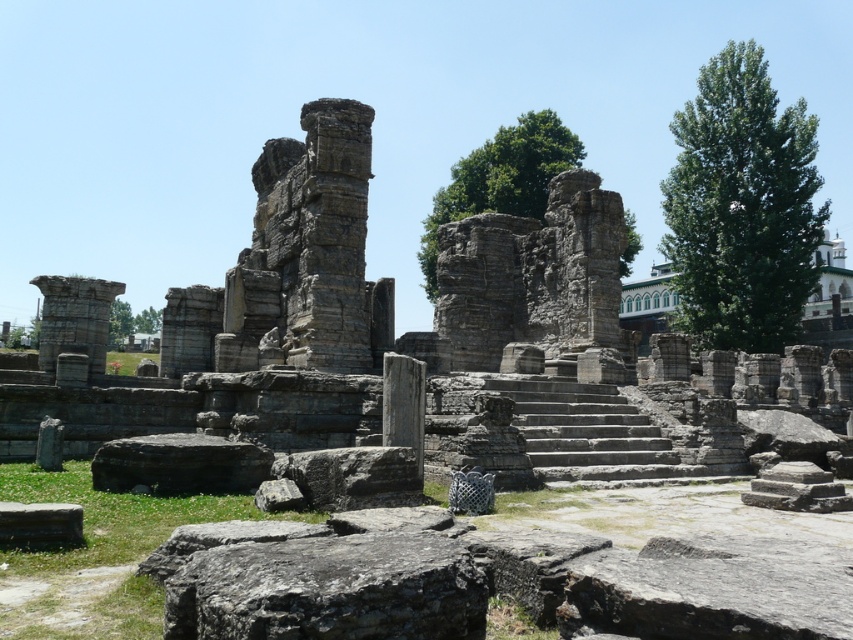
Between point (328, 566) and point (225, 452), which one is positioned behind?

Positioned behind is point (225, 452).

Which is more to the left, gray rough stone at center or gray rough stone at lower center?

gray rough stone at lower center is more to the left.

Does point (358, 541) come farther from viewer compared to point (206, 481)?

That is False.

The width and height of the screenshot is (853, 640). What are the coordinates of `gray rough stone at center` in the screenshot? It's located at (329, 589).

Does gray rough stone at lower center have a greater height compared to gray stone at lower left?

Indeed, gray rough stone at lower center has a greater height compared to gray stone at lower left.

Who is shorter, gray rough stone at lower center or gray stone at lower left?

gray stone at lower left

This screenshot has width=853, height=640. Describe the element at coordinates (180, 465) in the screenshot. I see `gray rough stone at lower center` at that location.

You are a GUI agent. You are given a task and a screenshot of the screen. Output one action in this format:
    pyautogui.click(x=<x>, y=<y>)
    Task: Click on the gray rough stone at lower center
    This screenshot has width=853, height=640.
    Given the screenshot: What is the action you would take?
    pyautogui.click(x=180, y=465)

Is gray rough stone at center smaller than gray stone at lower left?

No, gray rough stone at center is not smaller than gray stone at lower left.

Does point (257, 582) come behind point (13, 515)?

No, (257, 582) is closer to viewer.

Find the location of `gray rough stone at center`. gray rough stone at center is located at coordinates (329, 589).